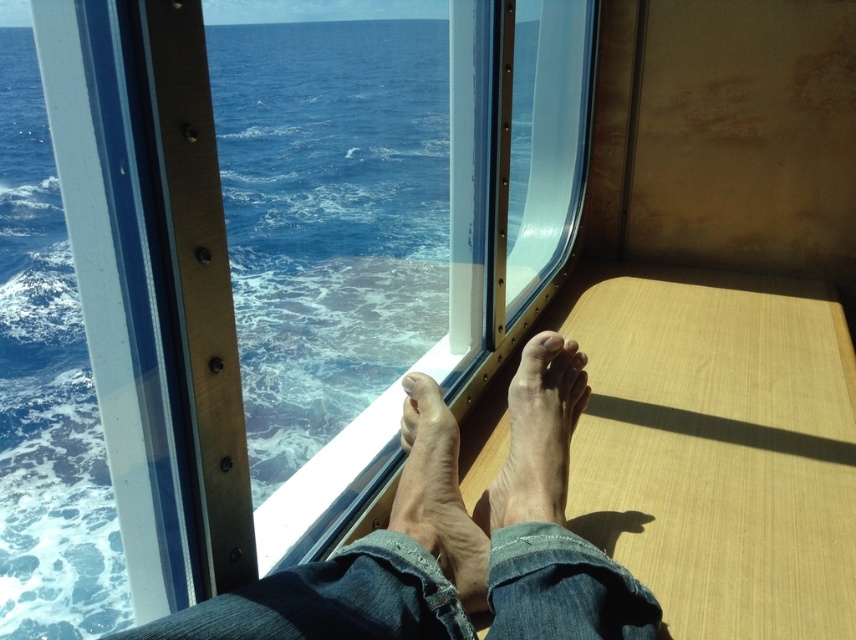
Is smooth skin feet at center thinner than dry skin foot at lower center?

Incorrect, smooth skin feet at center's width is not less than dry skin foot at lower center's.

Between smooth skin feet at center and dry skin foot at lower center, which one has less height?

dry skin foot at lower center is shorter.

What do you see at coordinates (453, 545) in the screenshot? Image resolution: width=856 pixels, height=640 pixels. I see `smooth skin feet at center` at bounding box center [453, 545].

This screenshot has width=856, height=640. In order to click on smooth skin feet at center in this screenshot , I will do `click(453, 545)`.

Who is positioned more to the left, smooth skin feet at center or matte skin toe at center?

smooth skin feet at center is more to the left.

Who is higher up, smooth skin feet at center or matte skin toe at center?

Positioned higher is matte skin toe at center.

Which is behind, point (360, 637) or point (548, 349)?

Point (548, 349)

The image size is (856, 640). I want to click on smooth skin feet at center, so click(x=453, y=545).

Which is more to the left, dry skin foot at lower center or matte skin toe at center?

From the viewer's perspective, dry skin foot at lower center appears more on the left side.

How far apart are dry skin foot at lower center and matte skin toe at center?

A distance of 5.35 inches exists between dry skin foot at lower center and matte skin toe at center.

Locate an element on the screen. dry skin foot at lower center is located at coordinates (536, 438).